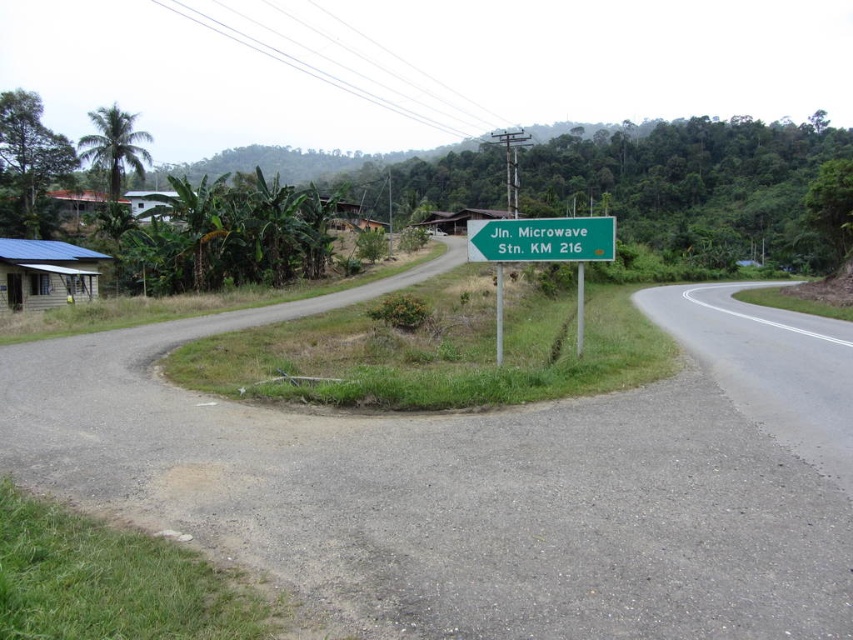
Question: Which point is farther to the camera?

Choices:
 (A) (573, 241)
 (B) (502, 227)

Answer: (B)

Question: Can you confirm if green plastic sign at center is positioned to the right of green metallic sign at center?

Choices:
 (A) yes
 (B) no

Answer: (A)

Question: Where is green plastic sign at center located in relation to green metallic sign at center in the image?

Choices:
 (A) above
 (B) below

Answer: (B)

Question: Which point is closer to the camera?

Choices:
 (A) (608, 237)
 (B) (598, 227)

Answer: (A)

Question: Does green plastic sign at center appear over green metallic sign at center?

Choices:
 (A) yes
 (B) no

Answer: (B)